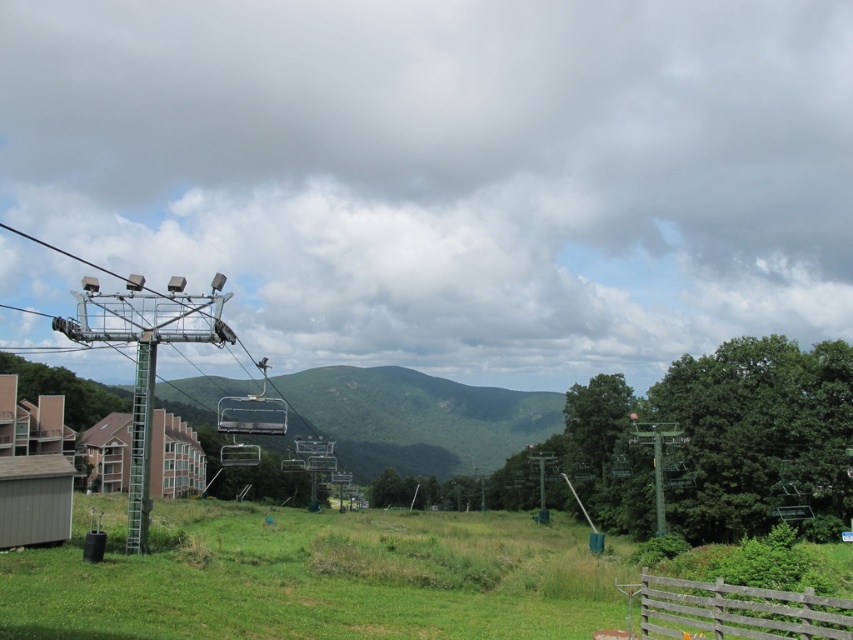
Is point (450, 632) closer to camera compared to point (689, 627)?

No.

Is green grassy field at lower center to the left of wooden fence at lower right from the viewer's perspective?

Yes, green grassy field at lower center is to the left of wooden fence at lower right.

Find the location of a particular element. green grassy field at lower center is located at coordinates (316, 577).

Is wooden fence at lower right thinner than green metallic pole at left?

Correct, wooden fence at lower right's width is less than green metallic pole at left's.

Which is behind, point (817, 605) or point (148, 456)?

The point (148, 456) is more distant.

The image size is (853, 640). In order to click on wooden fence at lower right in this screenshot , I will do `click(737, 611)`.

Is point (134, 412) behind point (252, 461)?

No, (134, 412) is in front of (252, 461).

Is green metallic pole at left above metallic gray chairlift at center?

Correct, green metallic pole at left is located above metallic gray chairlift at center.

Which is in front, point (154, 339) or point (258, 445)?

Point (154, 339)

Where is `green metallic pole at left`? green metallic pole at left is located at coordinates (140, 445).